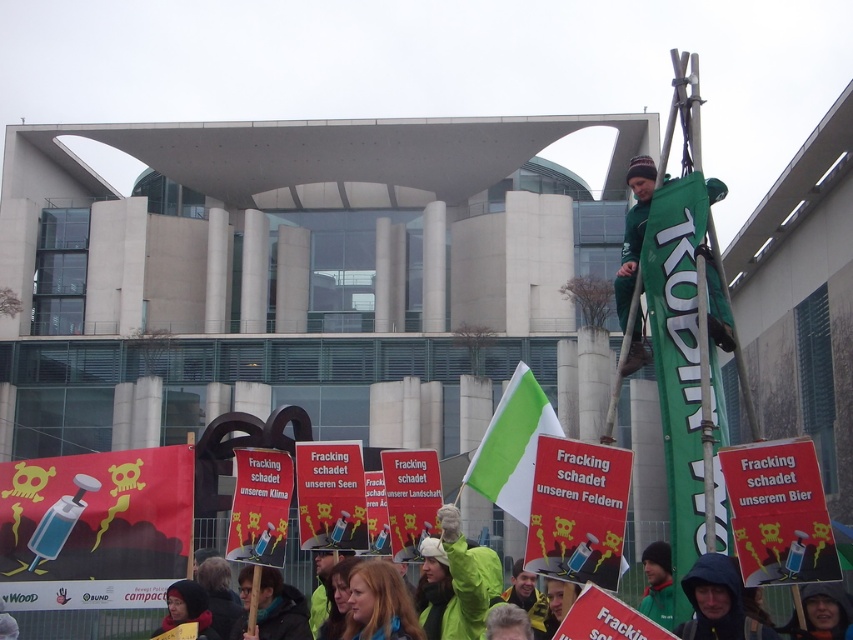
You are a journalist trying to capture the protest scene. You notice the green fabric flag at center. Based on its position, can you estimate whether it is closer to the front or the back of the protesters?

The green fabric flag at center is located at point coordinates that suggest it is positioned centrally within the protesters, so it is likely in the middle of the group, neither at the front nor the back.

You are a photographer standing at the lower center of the protest scene. You want to take a photo of the green fabric flag at center while also capturing the green fabric scarf at lower center in the frame. Given that your camera has a maximum focus range of 10 meters, will you be able to capture both objects clearly in the same photo?

The distance between the green fabric flag at center and the green fabric scarf at lower center is 10.81 meters. Since your camera can only focus up to 10 meters, the objects are slightly out of range. You might need to adjust your position or use a different camera setting to ensure both are in focus.

You are a photographer trying to capture both the green fabric flag at center and the green fabric banner at upper right in a single shot. Which object should you focus on first to ensure both are in frame?

You should focus on the green fabric banner at upper right first because the green fabric flag at center is in front of it, allowing both to be captured in the same frame when starting from the background object.